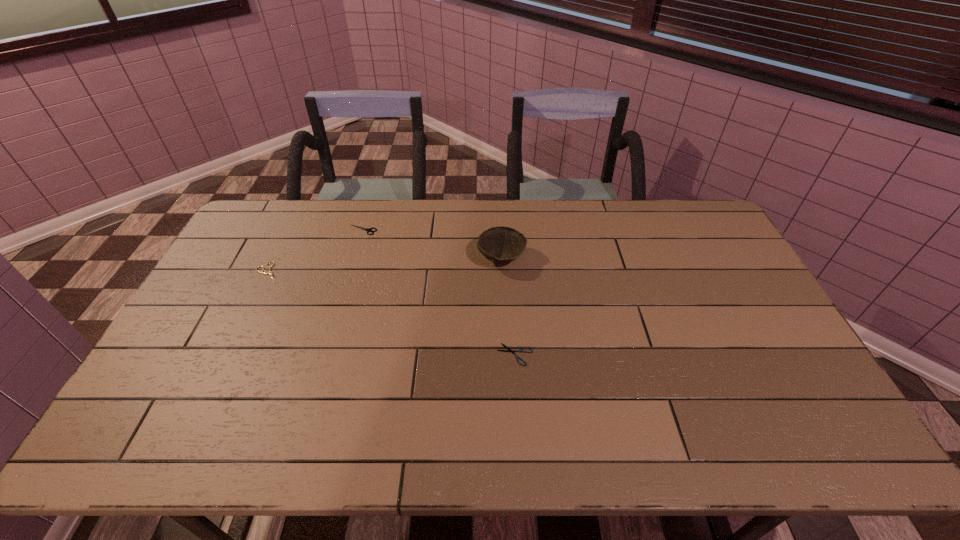
Identify the location of bowl. (501, 245).

Identify the location of the second shears from right to left. (366, 229).

Identify the location of the second tallest object. The height and width of the screenshot is (540, 960). (366, 229).

Where is `the second shortest shears`? This screenshot has height=540, width=960. the second shortest shears is located at coordinates (270, 272).

Locate an element on the screen. This screenshot has width=960, height=540. the third tallest object is located at coordinates (270, 272).

Locate an element on the screen. Image resolution: width=960 pixels, height=540 pixels. the rightmost shears is located at coordinates (509, 350).

Identify the location of the shortest shears. This screenshot has width=960, height=540. (509, 350).

I want to click on vacant space located 0.290m on the front of the tallest object, so click(506, 349).

This screenshot has width=960, height=540. Identify the location of blank space located 0.330m on the front of the farthest shears. (340, 305).

Locate an element on the screen. This screenshot has width=960, height=540. vacant region located 0.210m on the back of the second shortest shears is located at coordinates (293, 223).